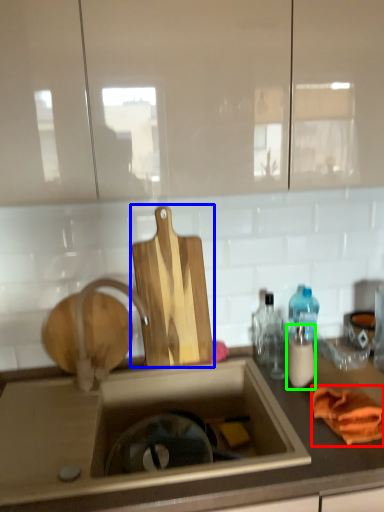
Question: Which object is positioned closest to material (highlighted by a red box)? Select from cutting board (highlighted by a blue box) and bottle (highlighted by a green box).

Choices:
 (A) cutting board
 (B) bottle

Answer: (B)